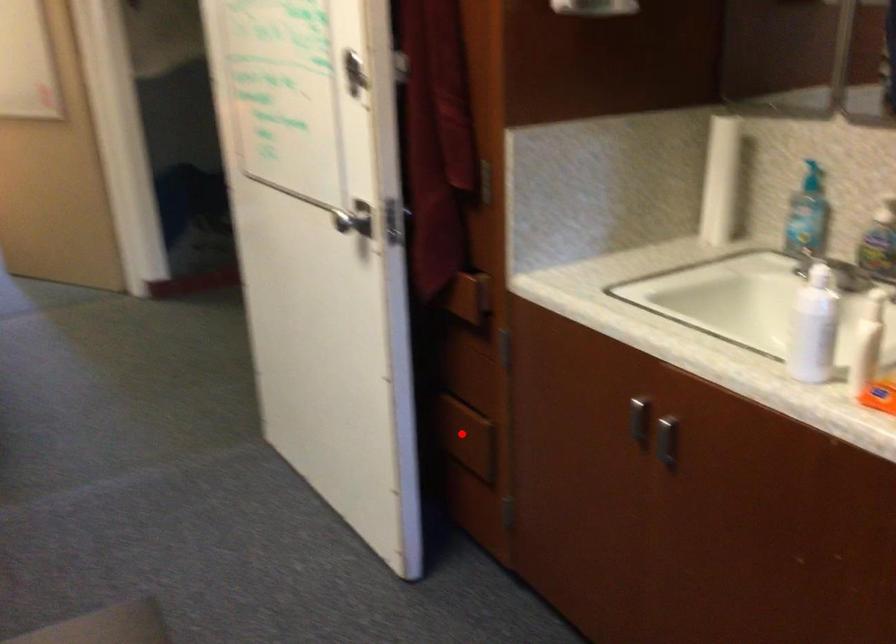
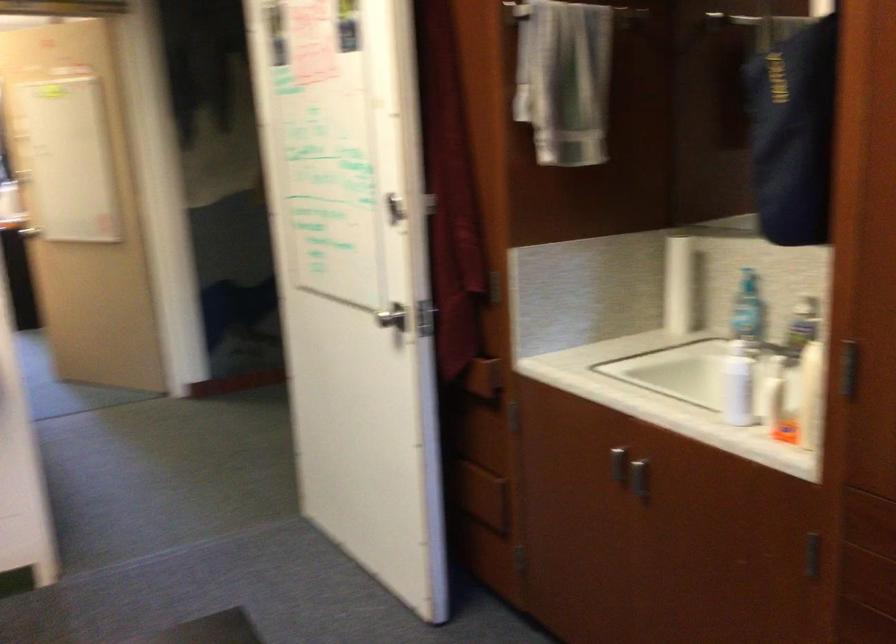
Find the pixel in the second image that matches the highlighted location in the first image.

(479, 495)